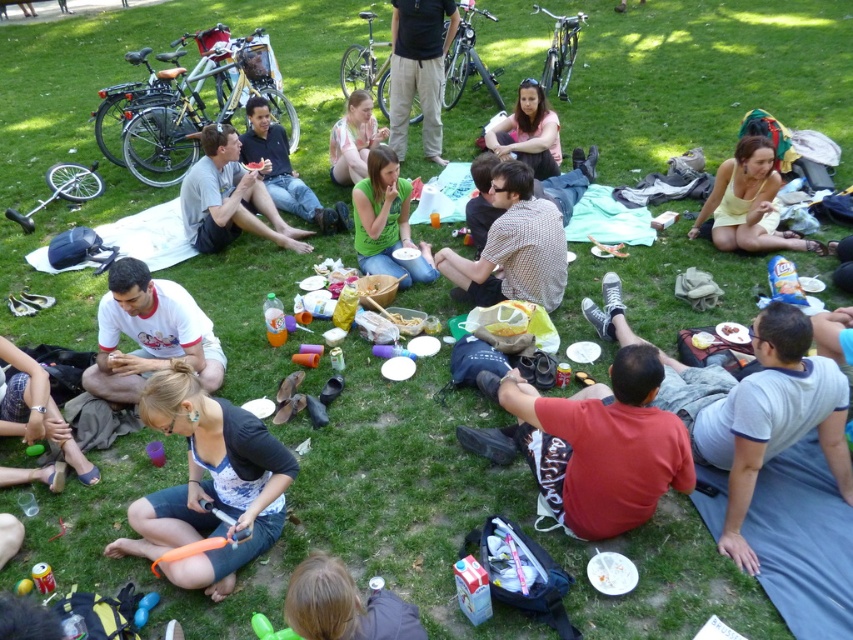
You are a photographer taking a picture of the picnic scene. You want to ensure that both the blonde hair at lower center and the black cotton shirt at center are clearly visible in the frame. Based on their positions, which object should you focus on first to ensure both are in focus?

The blonde hair at lower center is below the black cotton shirt at center, so you should focus on the black cotton shirt at center first to ensure both are in focus.

You are a photographer standing at the edge of the picnic area. You want to take a photo of the gray cotton shirt at lower right and the red cotton shirt at lower right. Given that your camera has a minimum focus distance of 60 centimeters, will both shirts be in focus if you position yourself exactly at this distance?

The distance between the gray cotton shirt at lower right and the red cotton shirt at lower right is 59.92 centimeters. Since the minimum focus distance is 60 centimeters, the camera cannot focus on objects closer than that. Therefore, both shirts will not be in focus as they are slightly within the minimum required distance.

You are at the picnic and want to find the gray cotton shirt at lower right. Which direction should you move from point (x=759, y=413) to reach it?

The point (x=759, y=413) is already on the gray cotton shirt at lower right, so you don